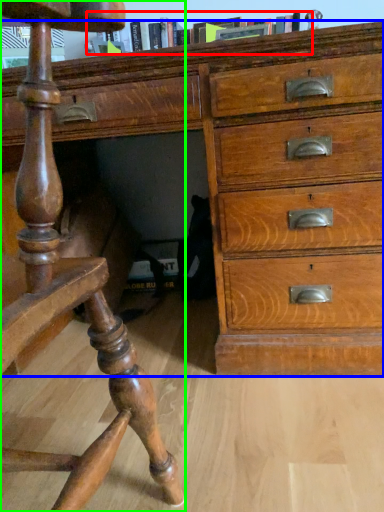
Question: Which object is the closest to the book (highlighted by a red box)? Choose among these: chest of drawers (highlighted by a blue box) or furniture (highlighted by a green box).

Choices:
 (A) chest of drawers
 (B) furniture

Answer: (A)